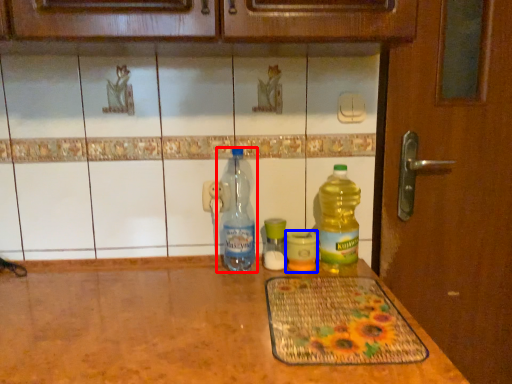
Question: Which point is further to the camera, bottle (highlighted by a red box) or bottle (highlighted by a blue box)?

Choices:
 (A) bottle
 (B) bottle

Answer: (B)